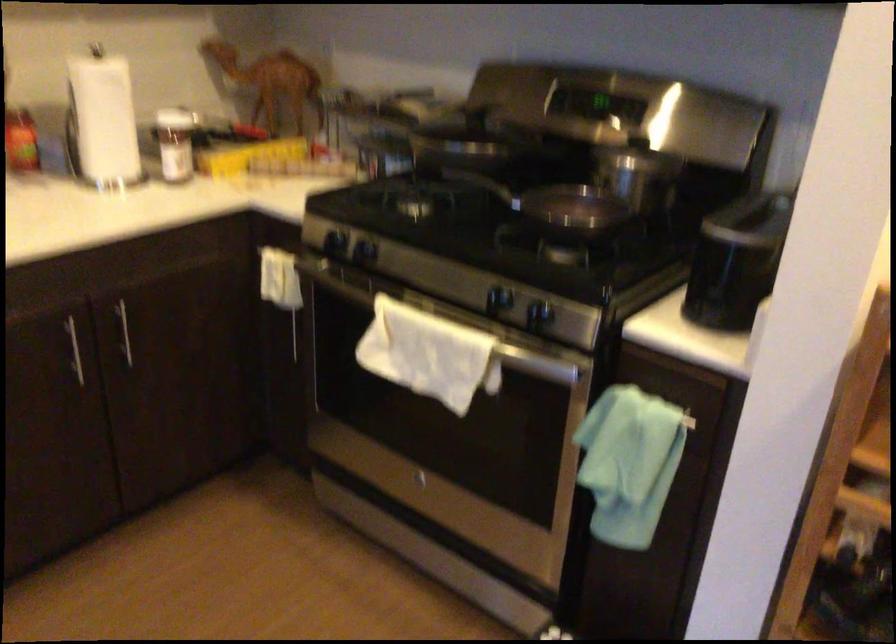
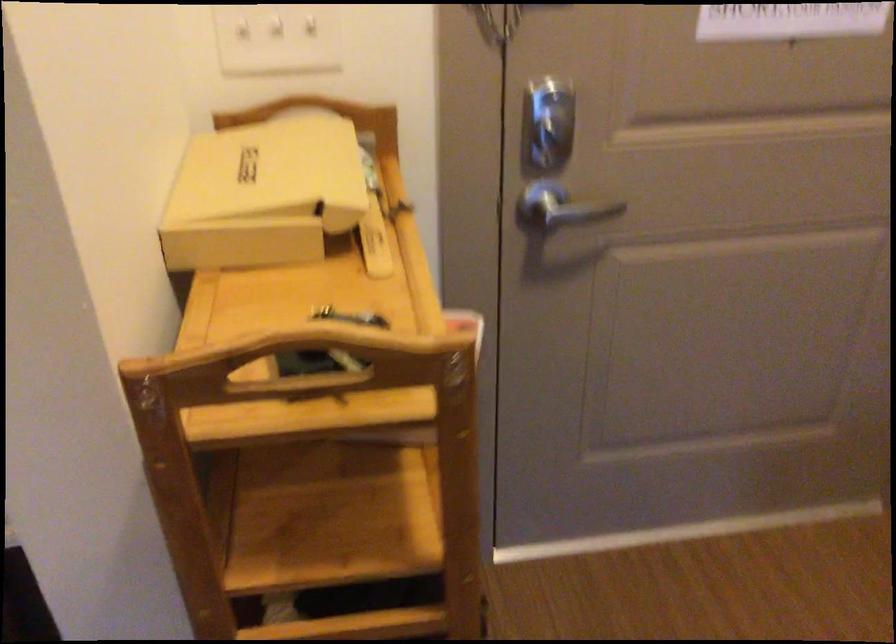
Question: The images are taken continuously from a first-person perspective. In which direction is your viewpoint rotating?

Choices:
 (A) Left
 (B) Right
 (C) Up
 (D) Down

Answer: (B)